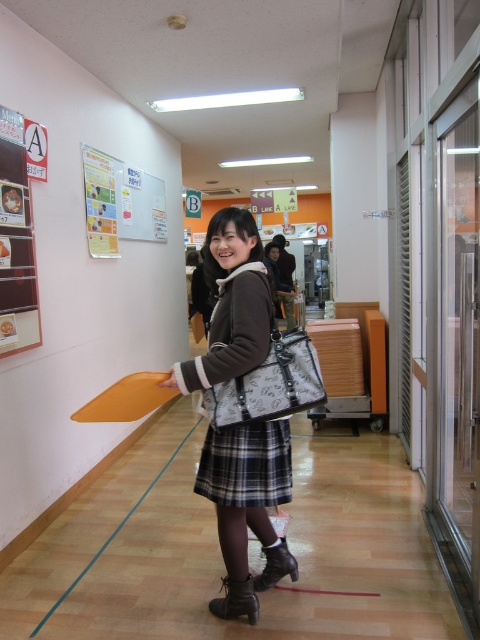
You are a photographer taking a picture of the plaid fabric skirt at center and the black leather boot at lower center. Which object will appear larger in the photo?

The plaid fabric skirt at center will appear larger in the photo since it is much taller than the black leather boot at lower center.

The scene shows a young woman wearing both a plaid fabric dress at center and a plaid fabric skirt at center. Which item of clothing is larger in size?

The plaid fabric dress at center is bigger than the plaid fabric skirt at center, so the dress is larger in size.

You are standing in the food court and want to walk towards the point that is closer to you. Which point should you head towards, point (262, 499) or point (279, 464)?

You should head towards point (262, 499) because it is closer to the viewer than point (279, 464).